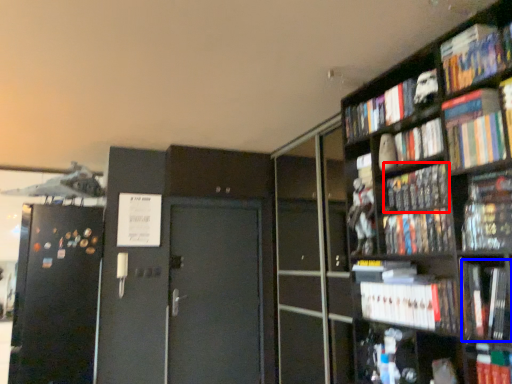
Question: Which object is further to the camera taking this photo, book (highlighted by a red box) or book (highlighted by a blue box)?

Choices:
 (A) book
 (B) book

Answer: (A)